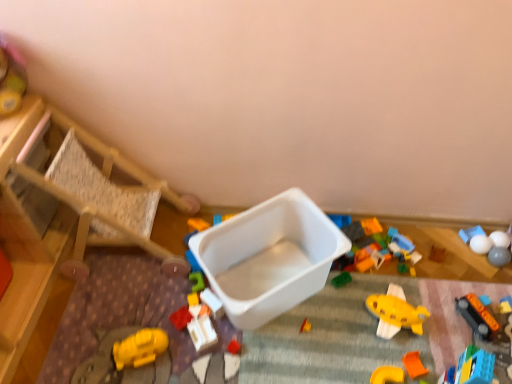
Locate an element on the screen. This screenshot has height=384, width=512. free space in front of wooden chair at left is located at coordinates (118, 321).